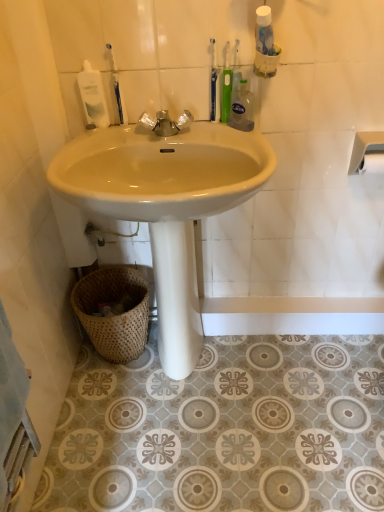
Question: Does white glossy mouthwash at upper left have a greater height compared to matte ceramic sink at center?

Choices:
 (A) yes
 (B) no

Answer: (B)

Question: Is the depth of white glossy mouthwash at upper left greater than that of matte ceramic sink at center?

Choices:
 (A) yes
 (B) no

Answer: (A)

Question: From a real-world perspective, is white glossy mouthwash at upper left on matte ceramic sink at center?

Choices:
 (A) yes
 (B) no

Answer: (A)

Question: Is the depth of white glossy mouthwash at upper left less than that of matte ceramic sink at center?

Choices:
 (A) no
 (B) yes

Answer: (A)

Question: Are white glossy mouthwash at upper left and matte ceramic sink at center far apart?

Choices:
 (A) yes
 (B) no

Answer: (B)

Question: From a real-world perspective, is white plastic towel bar at upper right physically located above or below clear liquid soap at upper center?

Choices:
 (A) above
 (B) below

Answer: (B)

Question: Looking at their shapes, would you say white plastic towel bar at upper right is wider or thinner than clear liquid soap at upper center?

Choices:
 (A) thin
 (B) wide

Answer: (B)

Question: Is point (377, 131) positioned closer to the camera than point (231, 93)?

Choices:
 (A) closer
 (B) farther

Answer: (B)

Question: In terms of height, does white plastic towel bar at upper right look taller or shorter compared to clear liquid soap at upper center?

Choices:
 (A) tall
 (B) short

Answer: (B)

Question: From a real-world perspective, is green plastic toothbrush at upper center, positioned as the 2th toothbrush in right-to-left order, positioned above or below white plastic towel bar at upper right?

Choices:
 (A) below
 (B) above

Answer: (B)

Question: Choose the correct answer: Is green plastic toothbrush at upper center, positioned as the 2th toothbrush in right-to-left order, inside white plastic towel bar at upper right or outside it?

Choices:
 (A) inside
 (B) outside

Answer: (B)

Question: In the image, is green plastic toothbrush at upper center, the third toothbrush when ordered from left to right, positioned in front of or behind white plastic towel bar at upper right?

Choices:
 (A) behind
 (B) front

Answer: (B)

Question: Is point (223, 97) closer or farther from the camera than point (382, 153)?

Choices:
 (A) farther
 (B) closer

Answer: (B)

Question: Would you say matte ceramic sink at center is to the left or to the right of white glossy mouthwash at upper left in the picture?

Choices:
 (A) left
 (B) right

Answer: (B)

Question: From a real-world perspective, relative to white glossy mouthwash at upper left, is matte ceramic sink at center vertically above or below?

Choices:
 (A) below
 (B) above

Answer: (A)